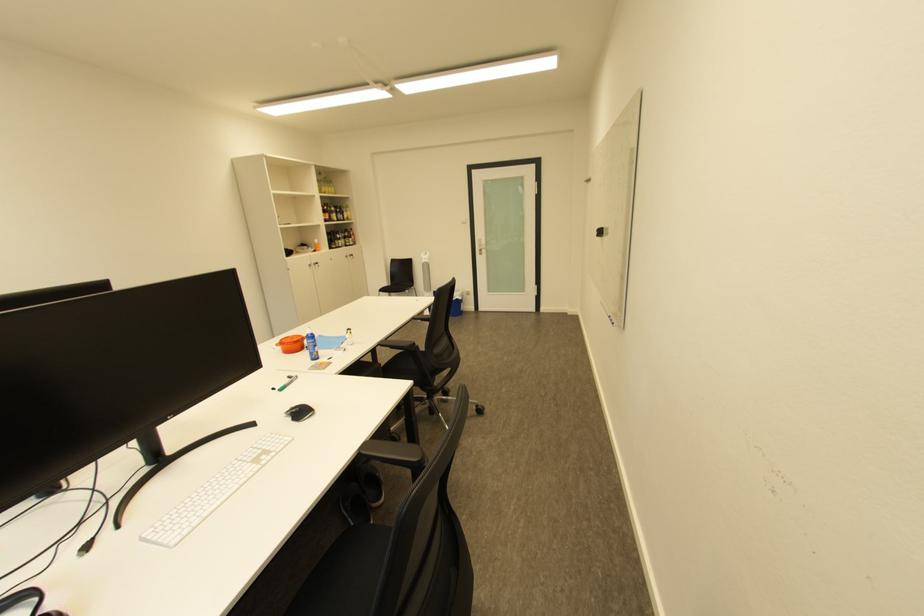
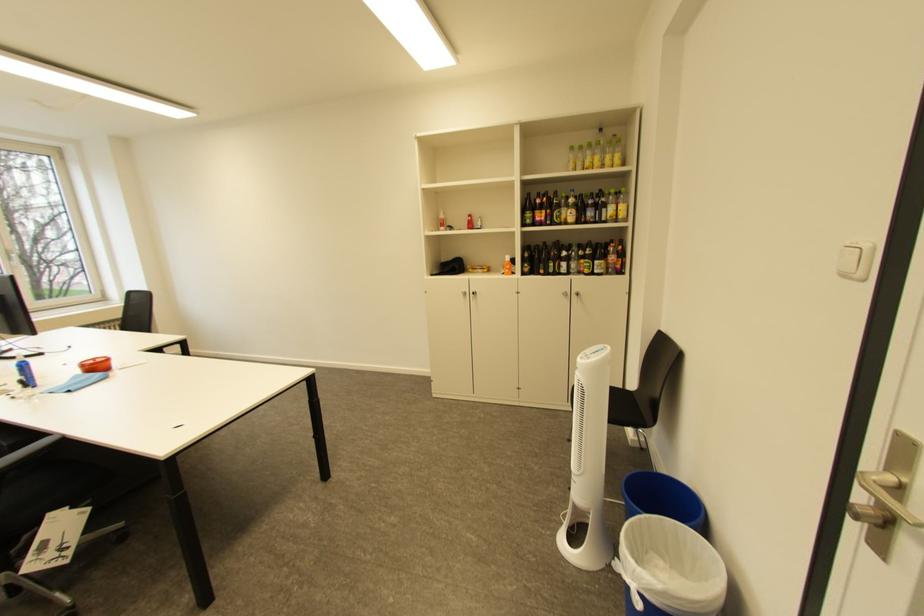
Find the pixel in the second image that matches point 472,224 in the first image.

(855, 277)